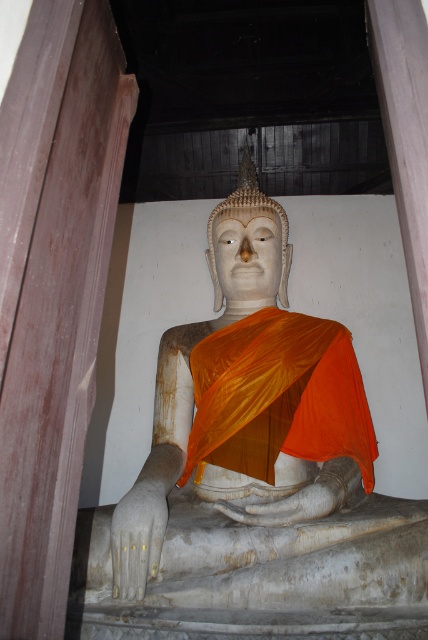
Question: From the image, what is the correct spatial relationship of white marble statue at center in relation to orange silk robe at center?

Choices:
 (A) above
 (B) below

Answer: (A)

Question: Which of the following is the closest to the observer?

Choices:
 (A) (389, 586)
 (B) (326, 326)

Answer: (A)

Question: Is white marble statue at center smaller than orange silk robe at center?

Choices:
 (A) no
 (B) yes

Answer: (A)

Question: Does white marble statue at center have a greater width compared to orange silk robe at center?

Choices:
 (A) no
 (B) yes

Answer: (B)